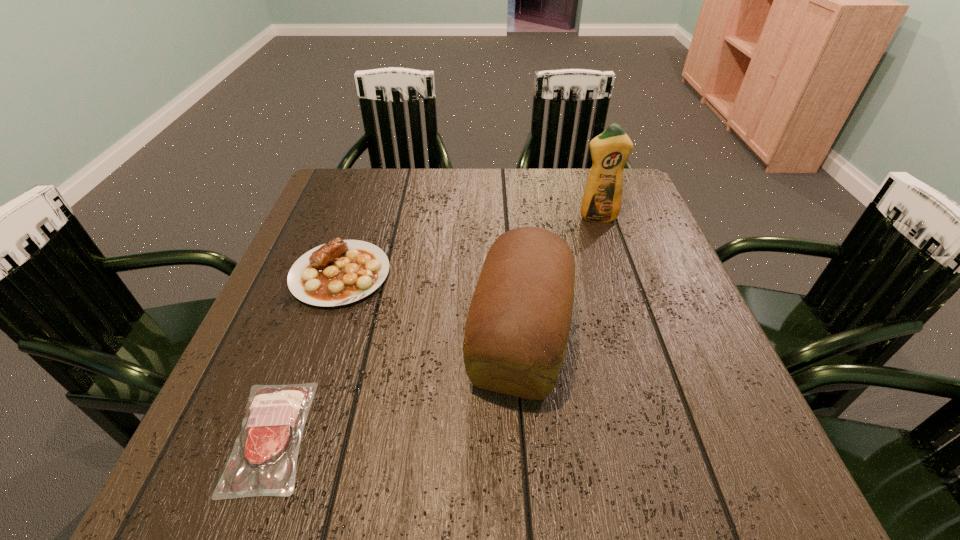
The image size is (960, 540). I want to click on vacant space that satisfies the following two spatial constraints: 1. on the back side of the taller steak; 2. on the left side of the shortest object, so click(x=330, y=274).